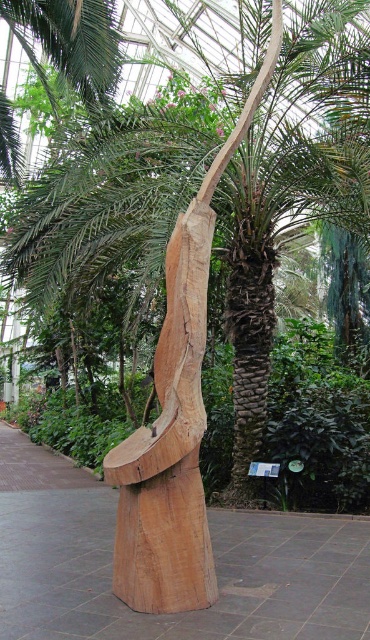
You are a visitor in the botanical garden and want to take a photo of the natural wood sculpture at center and the brown rough bark tree trunk at center. Which object is wider?

The natural wood sculpture at center is wider than the brown rough bark tree trunk at center because its width surpasses the latter.

In the scene shown: You are a visitor in the botanical garden and want to take a photo of the natural wood sculpture at center and the brown rough bark tree trunk at center. Which object should you focus on first if you want to capture both in a single frame without zooming in or out?

The natural wood sculpture at center is bigger than the brown rough bark tree trunk at center, so you should focus on the natural wood sculpture at center first to ensure it fits properly in the frame before adjusting for the smaller tree trunk.